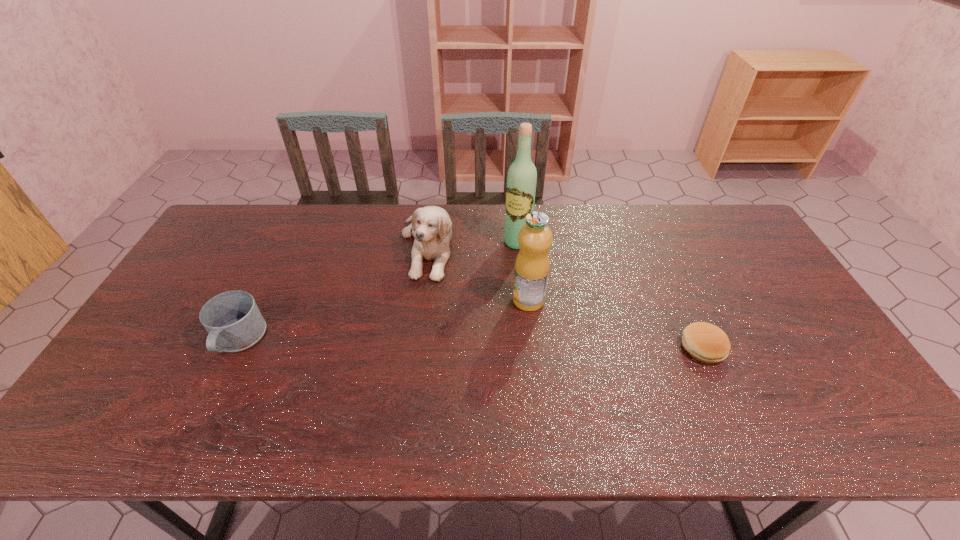
You are a GUI agent. You are given a task and a screenshot of the screen. Output one action in this format:
    pyautogui.click(x=<x>, y=<y>)
    Task: Click on the puppy that is at the far edge
    
    Given the screenshot: What is the action you would take?
    pyautogui.click(x=431, y=226)

The height and width of the screenshot is (540, 960). What are the coordinates of `wine bottle at the far edge` in the screenshot? It's located at (522, 176).

Locate an element on the screen. The image size is (960, 540). free space at the far edge of the desktop is located at coordinates (554, 237).

Image resolution: width=960 pixels, height=540 pixels. What are the coordinates of `free location at the near edge` in the screenshot? It's located at (325, 397).

You are a GUI agent. You are given a task and a screenshot of the screen. Output one action in this format:
    pyautogui.click(x=<x>, y=<y>)
    Task: Click on the vacant area at the left edge
    The image size is (960, 540).
    Given the screenshot: What is the action you would take?
    pyautogui.click(x=131, y=369)

Image resolution: width=960 pixels, height=540 pixels. I want to click on vacant space at the far right corner of the desktop, so 729,230.

The image size is (960, 540). In the image, there is a desktop. Identify the location of free region at the near right corner. click(x=859, y=394).

The height and width of the screenshot is (540, 960). What are the coordinates of `empty location between the mug and the shortest object` in the screenshot? It's located at (470, 344).

Locate an element on the screen. This screenshot has height=540, width=960. free spot between the leftmost object and the rightmost object is located at coordinates (470, 344).

I want to click on free space between the patty and the mug, so click(470, 344).